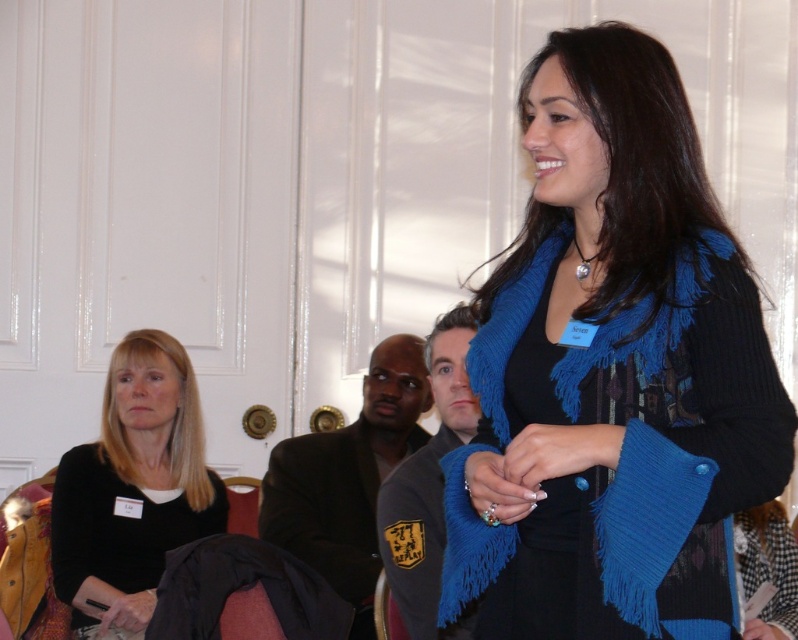
Based on the photo, you are a photographer trying to capture a photo of the blue knitted scarf at center and the black matte jacket at left in the same frame. Given that your camera has a maximum focus range of 6 feet, will both objects be in focus?

The blue knitted scarf at center and the black matte jacket at left are 6.34 feet apart. Since the camera can only focus within 6 feet, the distance between them exceeds the focus range. Therefore, both objects cannot be in focus simultaneously.

You are attending a virtual meeting and want to focus on the presenter. Where is the blue knitted scarf at center in relation to the presenter?

The blue knitted scarf at center is located at point 0.583 on the x axis and 0.768 on the y axis relative to the presenter.

Consider the image. You are attending a virtual meeting and see the blue knitted scarf at center and the black matte jacket at left. Which one is positioned more to the right side of the scene?

The blue knitted scarf at center is positioned more to the right side of the scene than the black matte jacket at left.